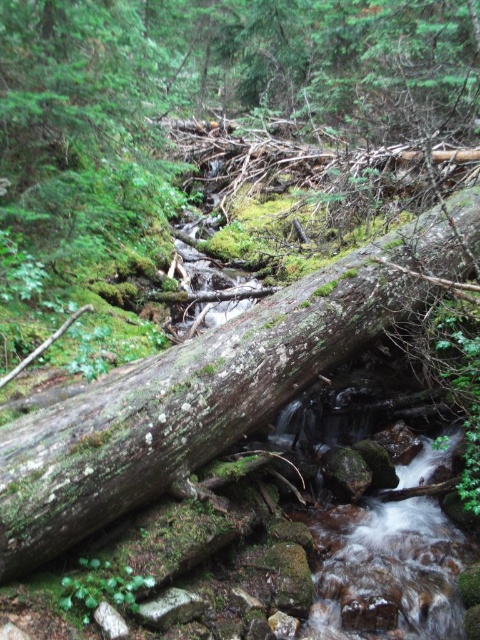
You are a hiker trying to cross the stream in the forest. You see the green mossy log at center and the clear water at stream center. Which object is higher in elevation?

The green mossy log at center is located above the clear water at stream center, so it is higher in elevation.

You are navigating through the forest and come across the green mossy log at center. Based on its position, can you determine if it is positioned closer to the top or bottom of the image?

The green mossy log at center is located at point coordinates approximately 0.608 on the x and 0.440 on the y axis. Since the y coordinate is closer to 0.5, it is positioned near the center vertically, so it is neither closer to the top nor the bottom of the image.